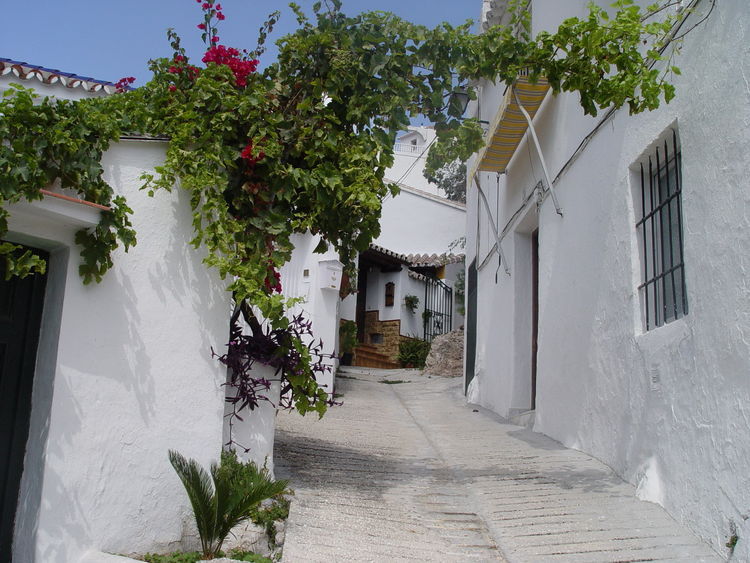
The width and height of the screenshot is (750, 563). Find the location of `canopy`. canopy is located at coordinates (507, 129).